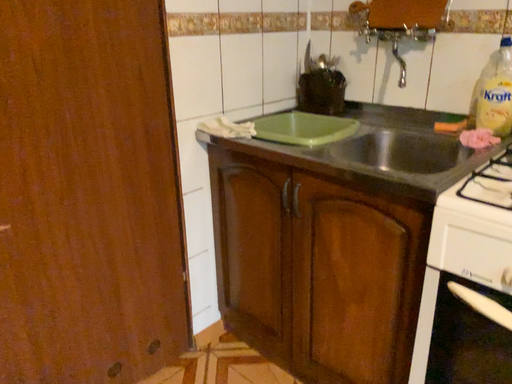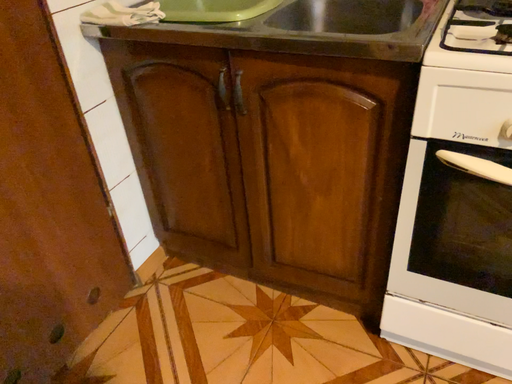
Question: How did the camera likely rotate when shooting the video?

Choices:
 (A) rotated left
 (B) rotated right

Answer: (B)